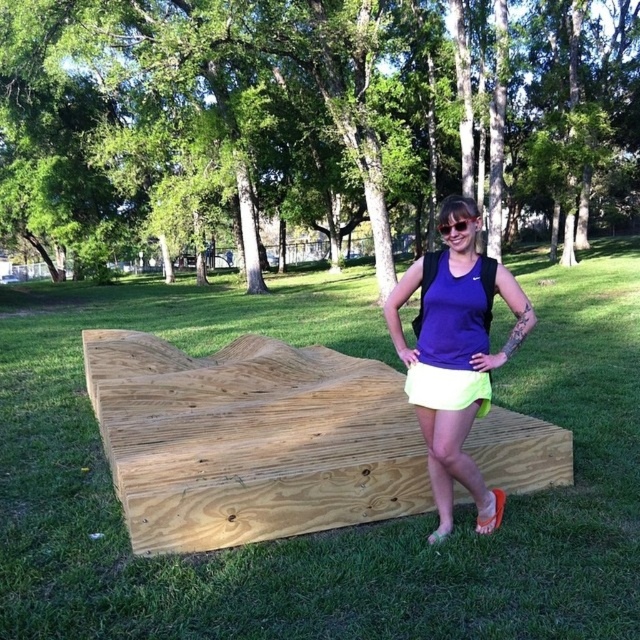
Question: Considering the relative positions of natural wood bench at center and clear plastic goggles at center in the image provided, where is natural wood bench at center located with respect to clear plastic goggles at center?

Choices:
 (A) right
 (B) left

Answer: (B)

Question: Estimate the real-world distances between objects in this image. Which object is farther from the clear plastic goggles at center?

Choices:
 (A) neon yellow fabric at center
 (B) purple matte tank top at center

Answer: (A)

Question: Which of these objects is positioned closest to the green grass at center?

Choices:
 (A) neon yellow fabric at center
 (B) natural wood bench at center
 (C) clear plastic goggles at center
 (D) purple matte tank top at center

Answer: (B)

Question: Is natural wood bench at center smaller than neon yellow fabric at center?

Choices:
 (A) no
 (B) yes

Answer: (A)

Question: Based on their relative distances, which object is farther from the neon yellow fabric at center?

Choices:
 (A) green grass at center
 (B) clear plastic goggles at center
 (C) purple matte tank top at center
 (D) natural wood bench at center

Answer: (A)

Question: Can you confirm if green grass at center is thinner than clear plastic goggles at center?

Choices:
 (A) yes
 (B) no

Answer: (B)